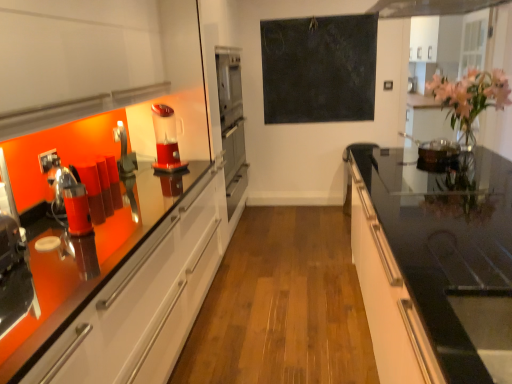
Find the location of a particular element. This screenshot has width=512, height=384. blank space situated above dark matte chalkboard at center (from a real-world perspective) is located at coordinates (314, 20).